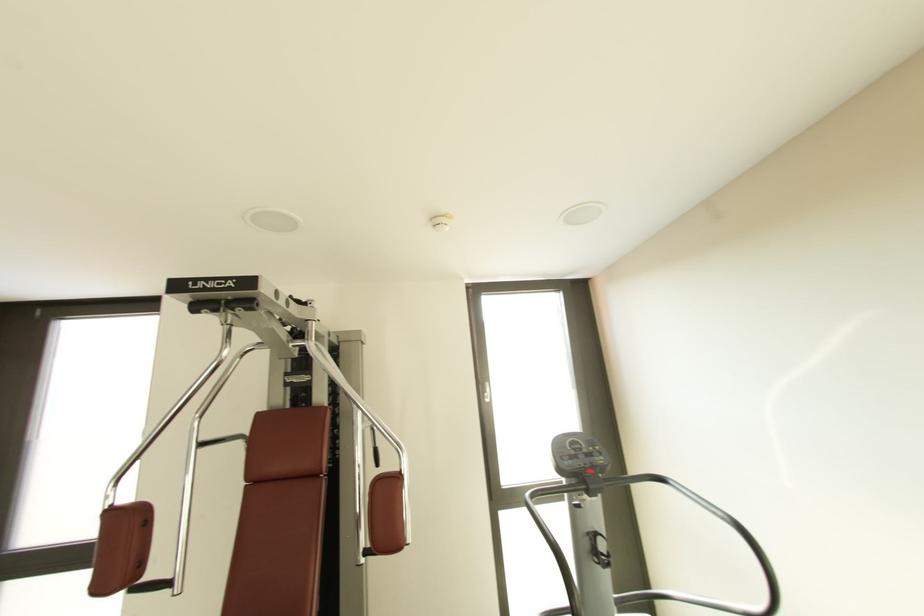
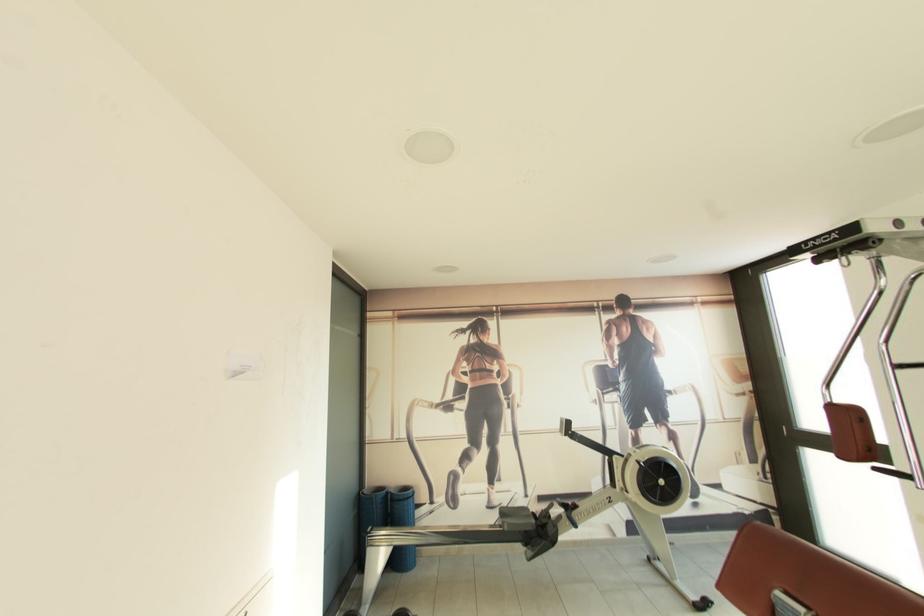
Question: The first image is from the beginning of the video and the second image is from the end. How did the camera likely rotate when shooting the video?

Choices:
 (A) Left
 (B) Right
 (C) Up
 (D) Down

Answer: (A)